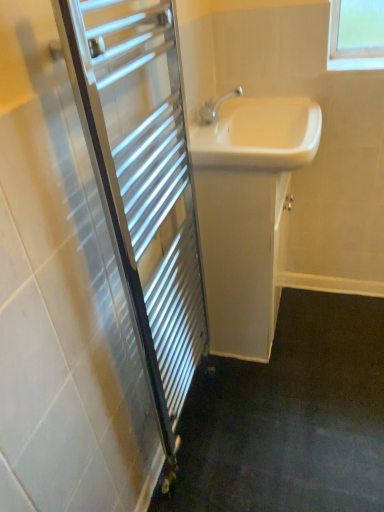
Question: From the image's perspective, does white glossy sink at center appear lower than white glossy cabinet at center?

Choices:
 (A) no
 (B) yes

Answer: (A)

Question: From a real-world perspective, is white glossy sink at center positioned over white glossy cabinet at center based on gravity?

Choices:
 (A) no
 (B) yes

Answer: (B)

Question: Could you tell me if white glossy sink at center is turned towards white glossy cabinet at center?

Choices:
 (A) yes
 (B) no

Answer: (B)

Question: Is white glossy sink at center placed right next to white glossy cabinet at center?

Choices:
 (A) no
 (B) yes

Answer: (A)

Question: Is white glossy sink at center to the right of white glossy cabinet at center from the viewer's perspective?

Choices:
 (A) yes
 (B) no

Answer: (A)

Question: From a real-world perspective, is chrome metallic towel rack at left above or below white glossy cabinet at center?

Choices:
 (A) above
 (B) below

Answer: (A)

Question: Considering the positions of chrome metallic towel rack at left and white glossy cabinet at center in the image, is chrome metallic towel rack at left wider or thinner than white glossy cabinet at center?

Choices:
 (A) thin
 (B) wide

Answer: (A)

Question: Do you think chrome metallic towel rack at left is within white glossy cabinet at center, or outside of it?

Choices:
 (A) inside
 (B) outside

Answer: (B)

Question: Relative to white glossy cabinet at center, is chrome metallic towel rack at left in front or behind?

Choices:
 (A) front
 (B) behind

Answer: (A)

Question: Visually, is white glossy cabinet at center positioned to the left or to the right of white glossy sink at center?

Choices:
 (A) right
 (B) left

Answer: (B)

Question: Looking at the image, does white glossy cabinet at center seem bigger or smaller compared to white glossy sink at center?

Choices:
 (A) small
 (B) big

Answer: (B)

Question: From the image's perspective, is white glossy cabinet at center located above or below white glossy sink at center?

Choices:
 (A) above
 (B) below

Answer: (B)

Question: Would you say white glossy cabinet at center is inside or outside white glossy sink at center?

Choices:
 (A) inside
 (B) outside

Answer: (B)

Question: From a real-world perspective, is white glossy sink at center above or below chrome metallic towel rack at left?

Choices:
 (A) below
 (B) above

Answer: (B)

Question: Does point (274, 133) appear closer or farther from the camera than point (175, 261)?

Choices:
 (A) farther
 (B) closer

Answer: (A)